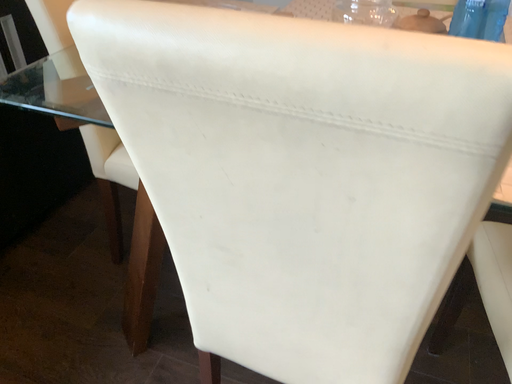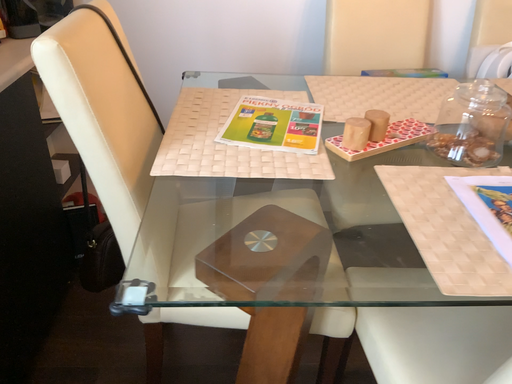
Question: How did the camera likely rotate when shooting the video?

Choices:
 (A) rotated right
 (B) rotated left

Answer: (A)